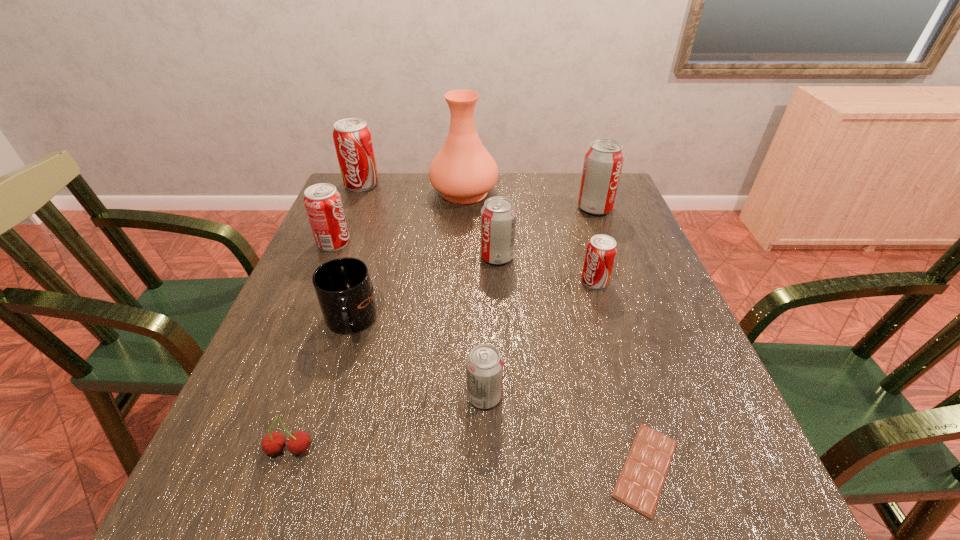
Image resolution: width=960 pixels, height=540 pixels. Find the location of `vacant point located between the rightmost red soda can and the fourth nearest object`. vacant point located between the rightmost red soda can and the fourth nearest object is located at coordinates (472, 302).

Locate an element on the screen. vacant region between the smallest red soda can and the cherry is located at coordinates (443, 366).

Image resolution: width=960 pixels, height=540 pixels. In order to click on empty space that is in between the second farthest red soda can and the second smallest gray soda can in this screenshot , I will do `click(416, 250)`.

This screenshot has height=540, width=960. What are the coordinates of `free space between the cherry and the second biggest gray soda can` in the screenshot? It's located at (394, 353).

At what (x,y) coordinates should I click in order to perform the action: click on vacant space that is in between the shortest object and the smallest gray soda can. Please return your answer as a coordinate pair (x, y). Looking at the image, I should click on click(x=565, y=432).

This screenshot has height=540, width=960. Find the location of `free area in between the vase and the biggest red soda can`. free area in between the vase and the biggest red soda can is located at coordinates (413, 188).

Locate which object ranks ninth in proximity to the third nearest object. Please provide its 2D coordinates. Your answer should be formatted as a tuple, i.e. [(x, y)], where the tuple contains the x and y coordinates of a point satisfying the conditions above.

[(352, 137)]

Select which object appears as the eighth closest to the second smallest gray soda can. Please provide its 2D coordinates. Your answer should be formatted as a tuple, i.e. [(x, y)], where the tuple contains the x and y coordinates of a point satisfying the conditions above.

[(639, 486)]

The image size is (960, 540). I want to click on the sixth closest soda can to the mug, so click(x=603, y=162).

Choose which soda can is the fifth nearest neighbor to the cherry. Please provide its 2D coordinates. Your answer should be formatted as a tuple, i.e. [(x, y)], where the tuple contains the x and y coordinates of a point satisfying the conditions above.

[(352, 137)]